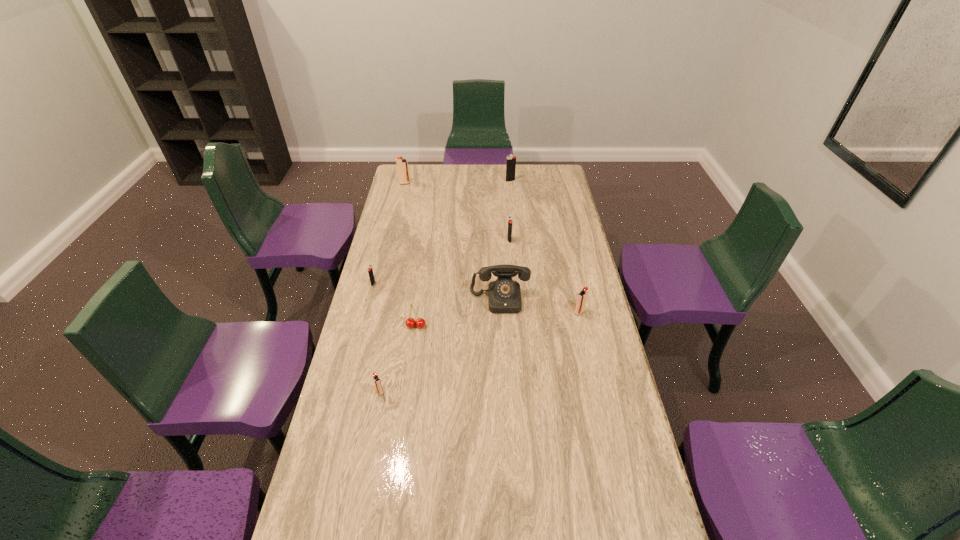
Identify the location of vacant region located 0.120m on the right of the nearest igniter. The height and width of the screenshot is (540, 960). (421, 392).

Where is `blank space located on the right of the smallest black igniter`? The width and height of the screenshot is (960, 540). blank space located on the right of the smallest black igniter is located at coordinates (418, 284).

What are the coordinates of `object that is at the right edge` in the screenshot? It's located at (582, 296).

Locate an element on the screen. The image size is (960, 540). object that is at the far left corner is located at coordinates (402, 164).

Where is `free space at the far edge of the desktop`? The height and width of the screenshot is (540, 960). free space at the far edge of the desktop is located at coordinates (473, 165).

In the image, there is a desktop. In order to click on vacant space at the left edge in this screenshot , I will do `click(407, 226)`.

Find the location of `free spot at the right edge of the desktop`. free spot at the right edge of the desktop is located at coordinates (650, 521).

Image resolution: width=960 pixels, height=540 pixels. In order to click on free space between the second red igniter from left to right and the third farthest igniter in this screenshot , I will do `click(444, 316)`.

Image resolution: width=960 pixels, height=540 pixels. What are the coordinates of `free space between the red cherry and the farthest black igniter` in the screenshot? It's located at (463, 253).

The image size is (960, 540). I want to click on empty space between the fourth igniter from right to left and the farthest red igniter, so click(393, 287).